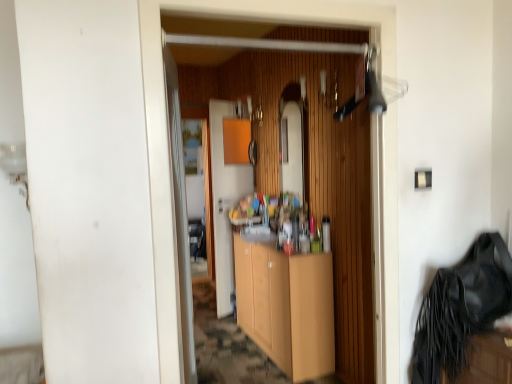
Question: Does wooden cabinet at center have a smaller size compared to light wood cabinet at center?

Choices:
 (A) no
 (B) yes

Answer: (B)

Question: Is wooden cabinet at center bigger than light wood cabinet at center?

Choices:
 (A) no
 (B) yes

Answer: (A)

Question: Could you tell me if wooden cabinet at center is turned towards light wood cabinet at center?

Choices:
 (A) yes
 (B) no

Answer: (B)

Question: Would you consider wooden cabinet at center to be distant from light wood cabinet at center?

Choices:
 (A) no
 (B) yes

Answer: (A)

Question: Considering the relative positions of wooden cabinet at center and light wood cabinet at center in the image provided, is wooden cabinet at center in front of light wood cabinet at center?

Choices:
 (A) yes
 (B) no

Answer: (B)

Question: Does wooden cabinet at center have a greater width compared to light wood cabinet at center?

Choices:
 (A) yes
 (B) no

Answer: (B)

Question: From the image's perspective, does light wood cabinet at center appear higher than wooden cabinet at center?

Choices:
 (A) yes
 (B) no

Answer: (B)

Question: Can you confirm if light wood cabinet at center is thinner than wooden cabinet at center?

Choices:
 (A) yes
 (B) no

Answer: (B)

Question: Is light wood cabinet at center at the left side of wooden cabinet at center?

Choices:
 (A) no
 (B) yes

Answer: (A)

Question: From the image's perspective, is light wood cabinet at center under wooden cabinet at center?

Choices:
 (A) no
 (B) yes

Answer: (B)

Question: Is light wood cabinet at center to the right of wooden cabinet at center from the viewer's perspective?

Choices:
 (A) yes
 (B) no

Answer: (A)

Question: Does light wood cabinet at center lie in front of wooden cabinet at center?

Choices:
 (A) yes
 (B) no

Answer: (A)

Question: Which is correct: wooden cabinet at center is inside light wood cabinet at center, or outside of it?

Choices:
 (A) outside
 (B) inside

Answer: (A)